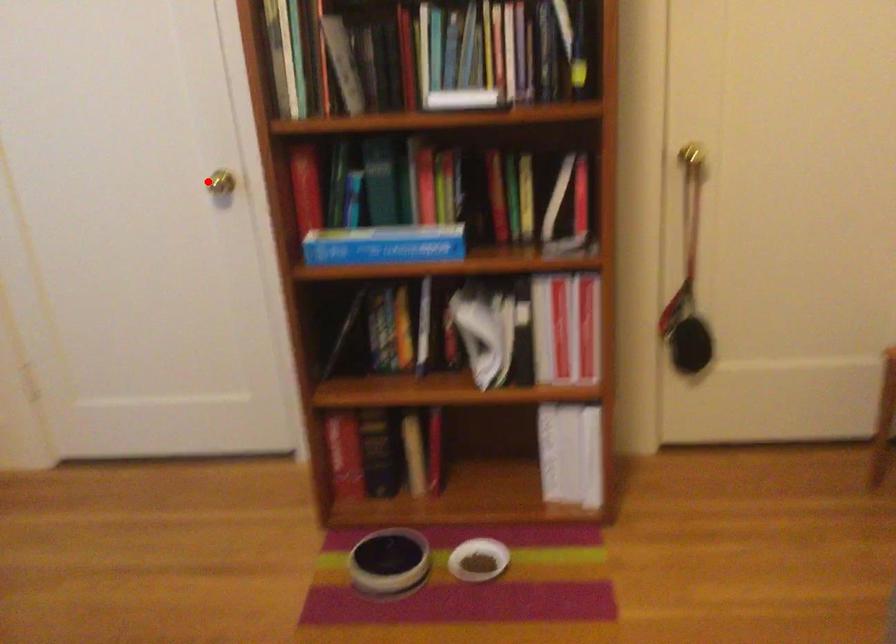
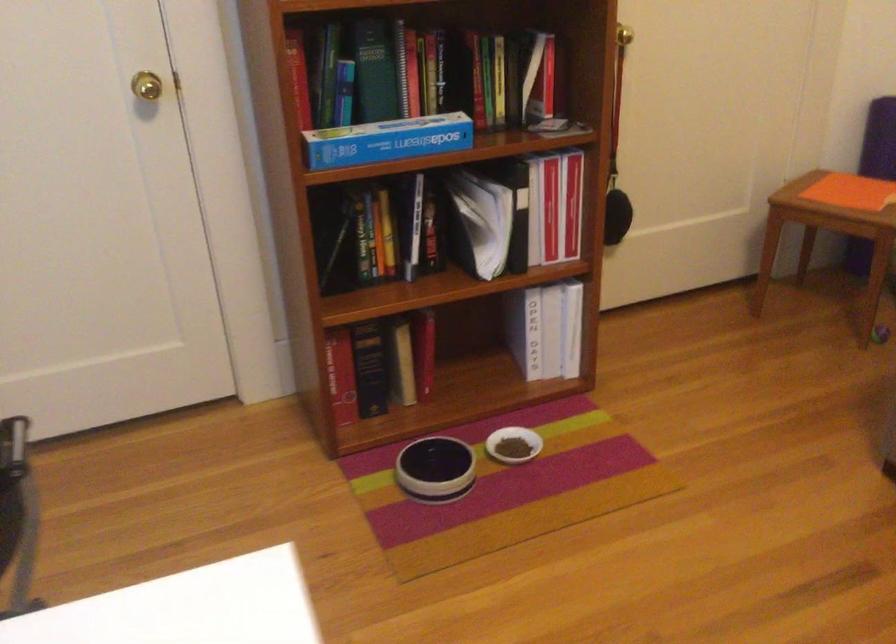
Find the pixel in the second image that matches the highlighted location in the first image.

(147, 86)